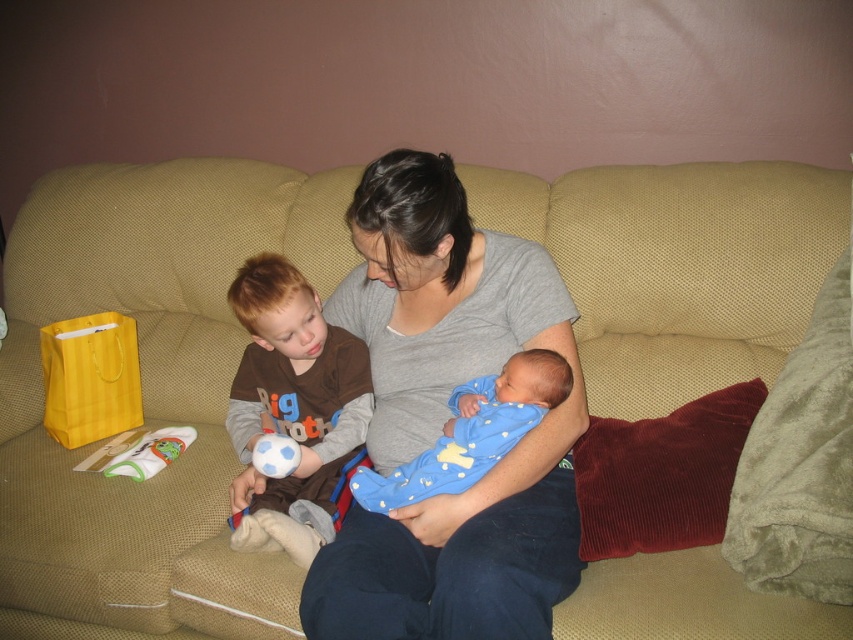
Is gray cotton shirt at center in front of blue soft fabric at center?

No, gray cotton shirt at center is behind blue soft fabric at center.

Is gray cotton shirt at center wider than blue soft fabric at center?

Correct, the width of gray cotton shirt at center exceeds that of blue soft fabric at center.

Locate an element on the screen. The image size is (853, 640). gray cotton shirt at center is located at coordinates (445, 419).

Is point (463, 625) farther from viewer compared to point (241, 518)?

No, (463, 625) is in front of (241, 518).

Does point (538, 291) come closer to viewer compared to point (338, 403)?

Yes.

Locate an element on the screen. This screenshot has height=640, width=853. gray cotton shirt at center is located at coordinates (445, 419).

Is point (306, 474) more distant than point (402, 477)?

Yes, point (306, 474) is behind point (402, 477).

Consider the image. Is the position of brown cotton shirt at left less distant than that of blue soft fabric baby at center?

No, brown cotton shirt at left is further to the viewer.

Who is more forward, (265, 353) or (451, 436)?

Point (451, 436) is more forward.

At what (x,y) coordinates should I click in order to perform the action: click on brown cotton shirt at left. Please return your answer as a coordinate pair (x, y). The width and height of the screenshot is (853, 640). Looking at the image, I should click on (293, 408).